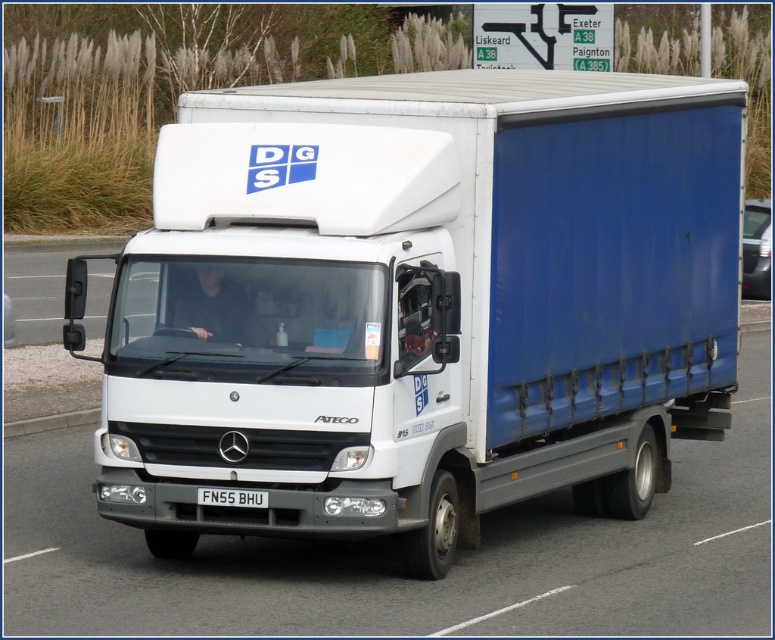
Question: Is white matte truck at center positioned in front of black metal license plate at center?

Choices:
 (A) yes
 (B) no

Answer: (B)

Question: Does white matte truck at center have a smaller size compared to black metal license plate at center?

Choices:
 (A) yes
 (B) no

Answer: (B)

Question: Which object is farther from the camera taking this photo?

Choices:
 (A) black metal license plate at center
 (B) white matte truck at center

Answer: (B)

Question: Is white matte truck at center positioned behind black metal license plate at center?

Choices:
 (A) no
 (B) yes

Answer: (B)